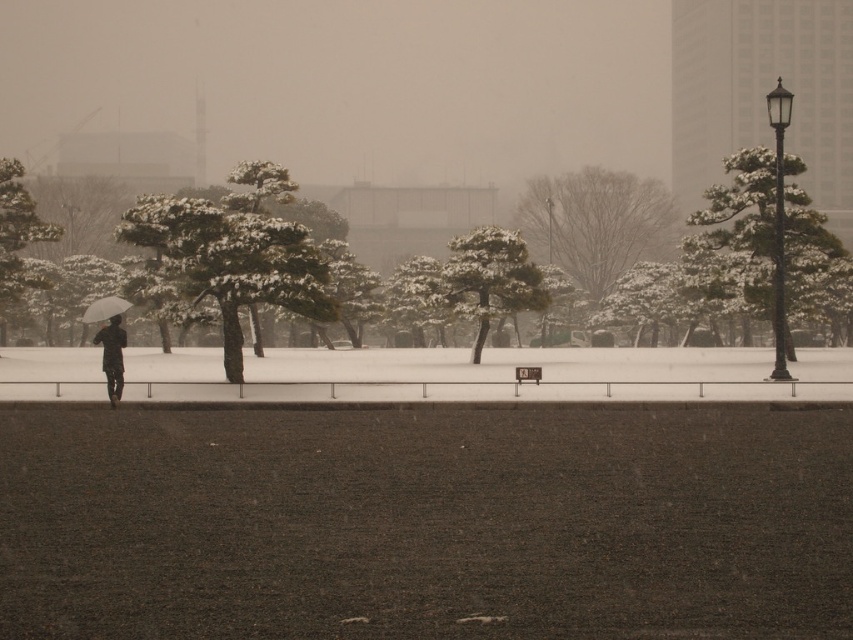
Question: Does snow-covered pine tree at right appear on the right side of white matte umbrella at left?

Choices:
 (A) no
 (B) yes

Answer: (B)

Question: Which of the following is the farthest from the observer?

Choices:
 (A) (486, 241)
 (B) (619, 234)

Answer: (B)

Question: Is snow-covered pine tree at center further to camera compared to white snow-covered tree at left?

Choices:
 (A) yes
 (B) no

Answer: (B)

Question: Which point is closer to the camera?

Choices:
 (A) (112, 308)
 (B) (485, 262)
 (C) (47, 234)
 (D) (286, 298)

Answer: (A)

Question: Is green textured pine tree at center behind dark brown leather jacket at left?

Choices:
 (A) no
 (B) yes

Answer: (B)

Question: Which object is positioned farthest from the snow-covered pine tree at right?

Choices:
 (A) green textured pine tree at center
 (B) white snow-covered tree at left

Answer: (B)